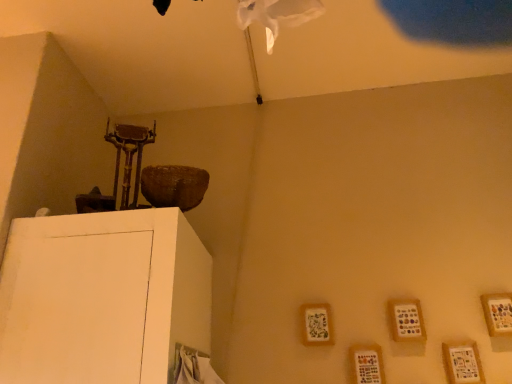
Question: Is wooden frame at lower right, which appears as the 3th picture frame when viewed from the right, touching wooden picture frame at lower right, arranged as the fourth picture frame when viewed from the right?

Choices:
 (A) no
 (B) yes

Answer: (A)

Question: Is wooden frame at lower right, positioned as the third picture frame in left-to-right order, far from wooden picture frame at lower right, arranged as the fourth picture frame when viewed from the right?

Choices:
 (A) no
 (B) yes

Answer: (A)

Question: Does wooden frame at lower right, which appears as the 3th picture frame when viewed from the right, have a greater height compared to wooden picture frame at lower right, positioned as the 2th picture frame in left-to-right order?

Choices:
 (A) no
 (B) yes

Answer: (B)

Question: From the image's perspective, is wooden frame at lower right, positioned as the third picture frame in left-to-right order, above wooden picture frame at lower right, arranged as the fourth picture frame when viewed from the right?

Choices:
 (A) yes
 (B) no

Answer: (A)

Question: Is the position of wooden frame at lower right, positioned as the third picture frame in left-to-right order, more distant than that of wooden picture frame at lower right, arranged as the fourth picture frame when viewed from the right?

Choices:
 (A) no
 (B) yes

Answer: (B)

Question: In terms of size, does wooden picture frame at lower right, arranged as the fourth picture frame when viewed from the right, appear bigger or smaller than wooden frame at lower right, arranged as the second picture frame when viewed from the right?

Choices:
 (A) big
 (B) small

Answer: (B)

Question: From the image's perspective, is wooden picture frame at lower right, positioned as the 2th picture frame in left-to-right order, above or below wooden frame at lower right, which is the 4th picture frame from left to right?

Choices:
 (A) below
 (B) above

Answer: (A)

Question: Considering the positions of wooden picture frame at lower right, arranged as the fourth picture frame when viewed from the right, and wooden frame at lower right, arranged as the second picture frame when viewed from the right, in the image, is wooden picture frame at lower right, arranged as the fourth picture frame when viewed from the right, taller or shorter than wooden frame at lower right, arranged as the second picture frame when viewed from the right,?

Choices:
 (A) tall
 (B) short

Answer: (A)

Question: Which is correct: wooden picture frame at lower right, arranged as the fourth picture frame when viewed from the right, is inside wooden frame at lower right, which is the 4th picture frame from left to right, or outside of it?

Choices:
 (A) inside
 (B) outside

Answer: (B)

Question: Is wooden frame at upper right, the 1th picture frame positioned from the right, wider or thinner than wooden frame at lower right, which appears as the 3th picture frame when viewed from the right?

Choices:
 (A) wide
 (B) thin

Answer: (B)

Question: From the image's perspective, is wooden frame at upper right, the 1th picture frame positioned from the right, positioned above or below wooden frame at lower right, which appears as the 3th picture frame when viewed from the right?

Choices:
 (A) below
 (B) above

Answer: (B)

Question: Visually, is wooden frame at upper right, acting as the fifth picture frame starting from the left, positioned to the left or to the right of wooden frame at lower right, positioned as the third picture frame in left-to-right order?

Choices:
 (A) right
 (B) left

Answer: (A)

Question: Is point (508, 306) closer or farther from the camera than point (412, 301)?

Choices:
 (A) closer
 (B) farther

Answer: (A)

Question: From a real-world perspective, relative to wooden frame at upper right, the 1th picture frame positioned from the right, is wooden frame at lower right, which appears as the 5th picture frame when viewed from the right, vertically above or below?

Choices:
 (A) below
 (B) above

Answer: (B)

Question: In terms of width, does wooden frame at lower right, positioned as the 1th picture frame in left-to-right order, look wider or thinner when compared to wooden frame at upper right, the 1th picture frame positioned from the right?

Choices:
 (A) thin
 (B) wide

Answer: (A)